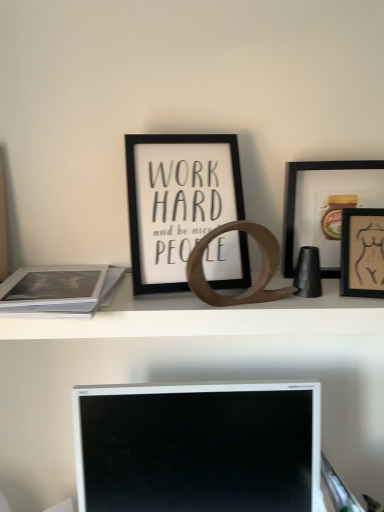
Question: Is matte black picture frame at right, arranged as the second picture frame when viewed from the left, at the right side of matte black picture frame at upper right, the 1th picture frame from the right?

Choices:
 (A) no
 (B) yes

Answer: (A)

Question: Considering the relative sizes of matte black picture frame at right, acting as the 2th picture frame starting from the right, and matte black picture frame at upper right, the 1th picture frame from the right, in the image provided, is matte black picture frame at right, acting as the 2th picture frame starting from the right, taller than matte black picture frame at upper right, the 1th picture frame from the right,?

Choices:
 (A) no
 (B) yes

Answer: (B)

Question: Is matte black picture frame at right, acting as the 2th picture frame starting from the right, turned away from matte black picture frame at upper right, the 1th picture frame from the right?

Choices:
 (A) yes
 (B) no

Answer: (A)

Question: Is matte black picture frame at upper right, the 3th picture frame from the left, a part of matte black picture frame at right, arranged as the second picture frame when viewed from the left?

Choices:
 (A) no
 (B) yes

Answer: (A)

Question: Is matte black picture frame at right, acting as the 2th picture frame starting from the right, thinner than matte black picture frame at upper right, the 3th picture frame from the left?

Choices:
 (A) no
 (B) yes

Answer: (A)

Question: Are matte black picture frame at right, acting as the 2th picture frame starting from the right, and matte black picture frame at upper right, the 1th picture frame from the right, located far from each other?

Choices:
 (A) yes
 (B) no

Answer: (B)

Question: Does white matte paper at left have a smaller size compared to wooden ring at center?

Choices:
 (A) no
 (B) yes

Answer: (B)

Question: Could you tell me if white matte paper at left is facing wooden ring at center?

Choices:
 (A) yes
 (B) no

Answer: (B)

Question: From the image's perspective, does white matte paper at left appear higher than wooden ring at center?

Choices:
 (A) yes
 (B) no

Answer: (A)

Question: Is white matte paper at left next to wooden ring at center?

Choices:
 (A) yes
 (B) no

Answer: (B)

Question: From a real-world perspective, is white matte paper at left positioned over wooden ring at center based on gravity?

Choices:
 (A) yes
 (B) no

Answer: (A)

Question: Is white matte paper at left thinner than wooden ring at center?

Choices:
 (A) no
 (B) yes

Answer: (A)

Question: Is white matte paper at left behind white glossy computer monitor at center?

Choices:
 (A) yes
 (B) no

Answer: (B)